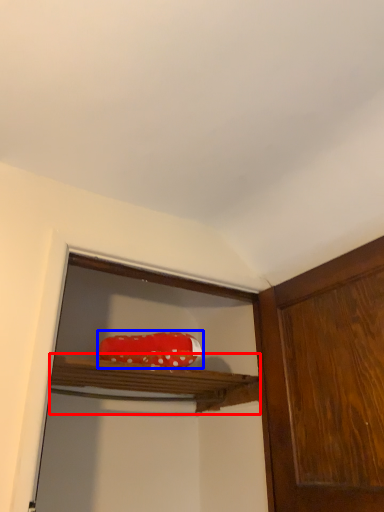
Question: Which object is further to the camera taking this photo, cabinet (highlighted by a red box) or stuff (highlighted by a blue box)?

Choices:
 (A) cabinet
 (B) stuff

Answer: (B)